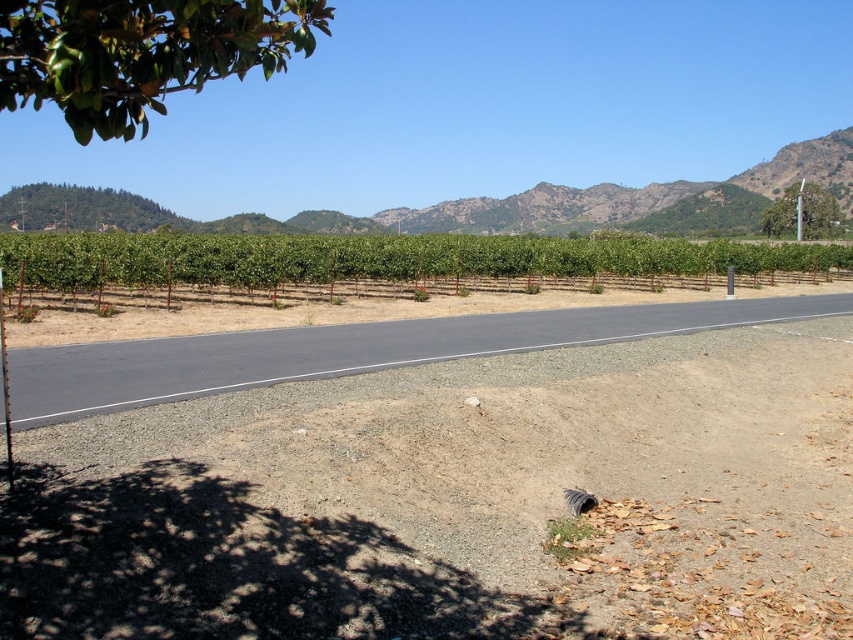
Between green leafy mountain at upper center and green leafy tree at upper right, which one has less height?

With less height is green leafy tree at upper right.

Does point (523, 218) come farther from viewer compared to point (811, 228)?

Yes, it is behind point (811, 228).

Who is more forward, (x=817, y=154) or (x=788, y=204)?

Positioned in front is point (x=788, y=204).

At what (x,y) coordinates should I click in order to perform the action: click on green leafy mountain at upper center. Please return your answer as a coordinate pair (x, y). Looking at the image, I should click on (485, 204).

Who is positioned more to the left, green leafy vines at center or green leafy tree at upper right?

Positioned to the left is green leafy vines at center.

Does green leafy vines at center appear on the left side of green leafy tree at upper right?

Indeed, green leafy vines at center is positioned on the left side of green leafy tree at upper right.

Does point (184, 278) come closer to viewer compared to point (792, 188)?

Yes, point (184, 278) is closer to viewer.

Locate an element on the screen. The image size is (853, 640). green leafy vines at center is located at coordinates (381, 259).

In the scene shown: Who is lower down, green glossy leaves at upper left or green leafy tree at upper right?

Positioned lower is green glossy leaves at upper left.

Which is behind, point (131, 19) or point (780, 218)?

The point (780, 218) is behind.

Find the location of a particular element. green glossy leaves at upper left is located at coordinates (140, 52).